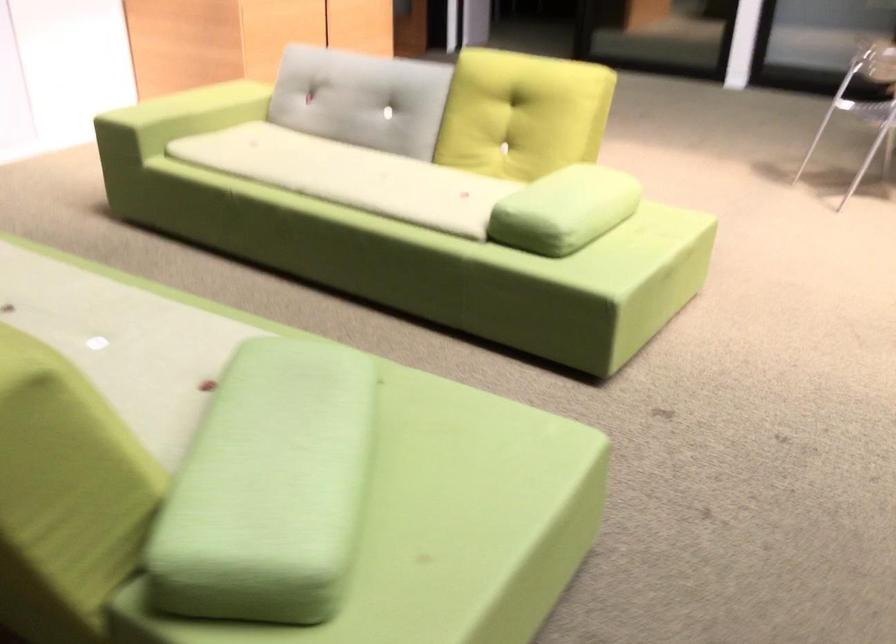
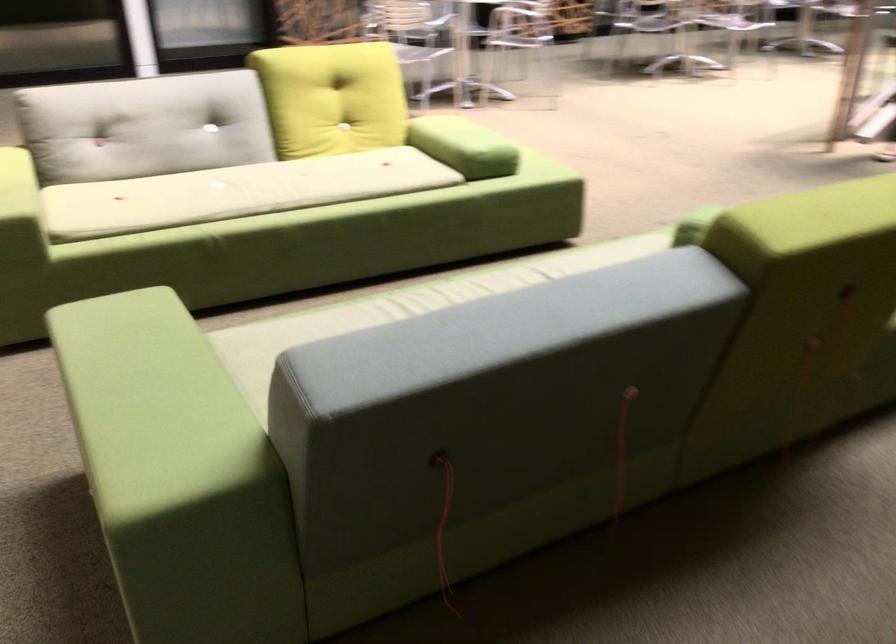
Find the pixel in the second image that matches (x=124, y=111) in the first image.

(19, 207)